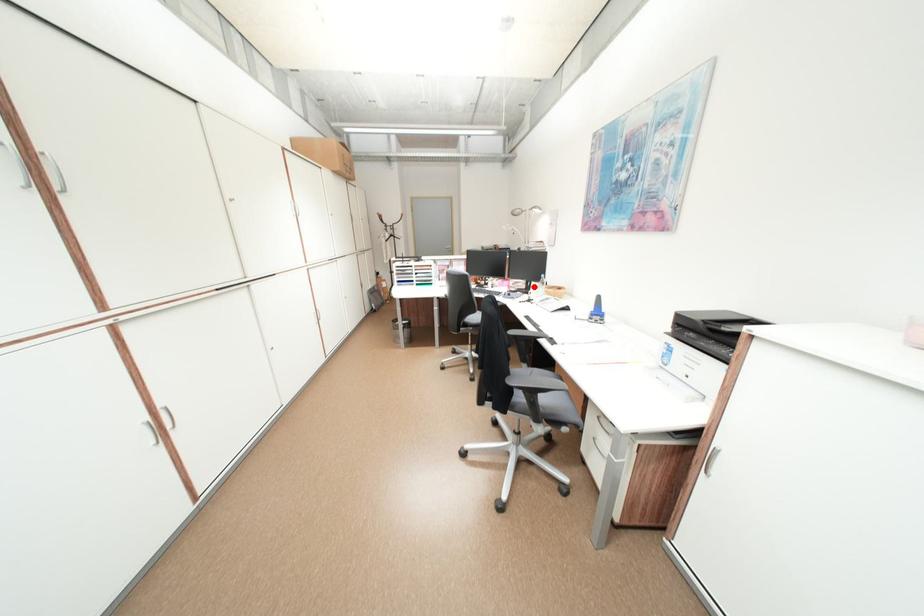
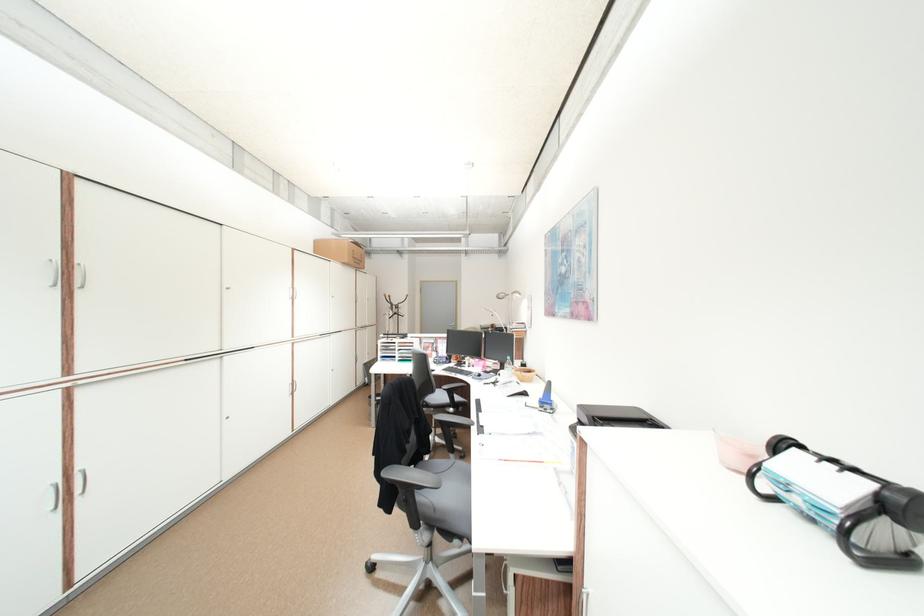
Question: I am providing you with two images of the same scene from different viewpoints. Image1 has a red point marked. In image2, the corresponding 3D location appears at what relative position? Reply with the corresponding letter.

Choices:
 (A) Closer
 (B) Farther

Answer: (B)